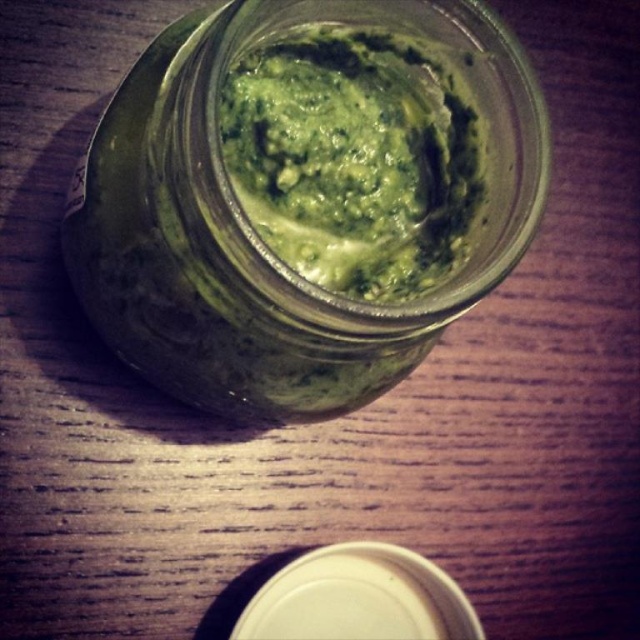
Question: Among these points, which one is farthest from the camera?

Choices:
 (A) (532, 116)
 (B) (324, 70)

Answer: (B)

Question: Which object appears closest to the camera in this image?

Choices:
 (A) green matte glass jar at center
 (B) green paste at center

Answer: (A)

Question: Does green matte glass jar at center lie behind green paste at center?

Choices:
 (A) yes
 (B) no

Answer: (B)

Question: In this image, where is green matte glass jar at center located relative to green paste at center?

Choices:
 (A) left
 (B) right

Answer: (A)

Question: Is green matte glass jar at center to the right of green paste at center from the viewer's perspective?

Choices:
 (A) no
 (B) yes

Answer: (A)